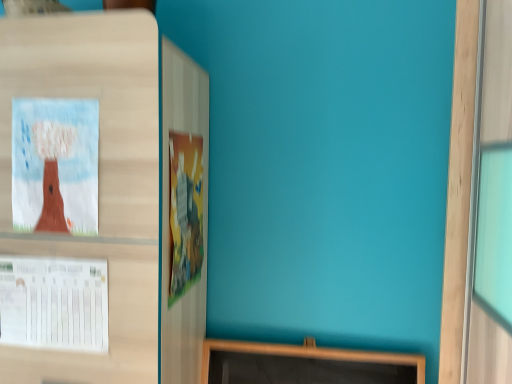
Question: From a real-world perspective, is white paper at left, the 2th poster from the right, above or below cartoonish paper poster at center, which ranks as the 2th poster in left-to-right order?

Choices:
 (A) above
 (B) below

Answer: (B)

Question: Relative to cartoonish paper poster at center, which ranks as the 2th poster in left-to-right order, is white paper at left, the 2th poster from the right, in front or behind?

Choices:
 (A) behind
 (B) front

Answer: (B)

Question: Considering the positions of white paper at left, the first poster from the left, and cartoonish paper poster at center, which is the 1th poster in right-to-left order, in the image, is white paper at left, the first poster from the left, wider or thinner than cartoonish paper poster at center, which is the 1th poster in right-to-left order,?

Choices:
 (A) thin
 (B) wide

Answer: (A)

Question: Is cartoonish paper poster at center, which is the 1th poster in right-to-left order, wider or thinner than white paper at left, the first poster from the left?

Choices:
 (A) thin
 (B) wide

Answer: (B)

Question: From the image's perspective, is cartoonish paper poster at center, which is the 1th poster in right-to-left order, located above or below white paper at left, the 2th poster from the right?

Choices:
 (A) above
 (B) below

Answer: (A)

Question: From a real-world perspective, relative to white paper at left, the first poster from the left, is cartoonish paper poster at center, which is the 1th poster in right-to-left order, vertically above or below?

Choices:
 (A) below
 (B) above

Answer: (B)

Question: Based on their sizes in the image, would you say cartoonish paper poster at center, which is the 1th poster in right-to-left order, is bigger or smaller than white paper at left, the first poster from the left?

Choices:
 (A) big
 (B) small

Answer: (A)